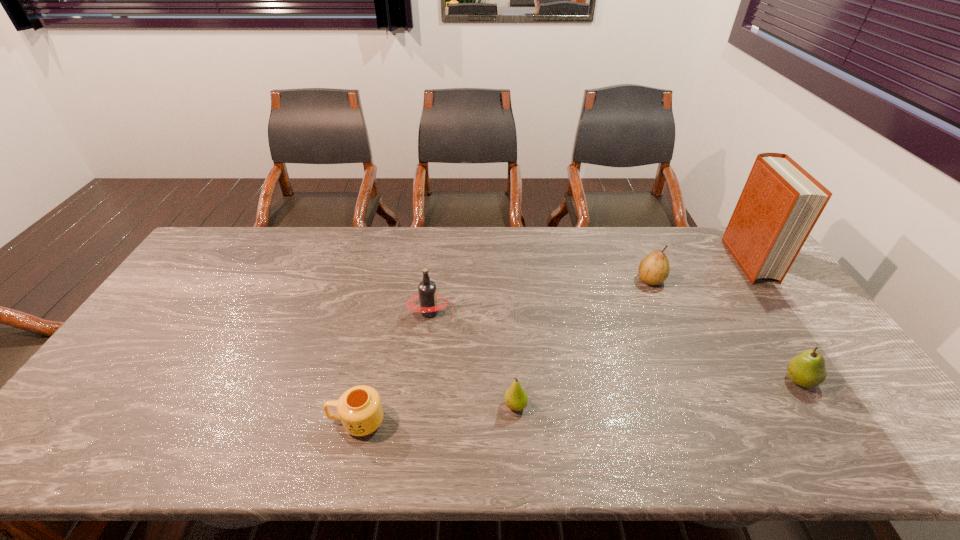
This screenshot has height=540, width=960. Find the location of `the rightmost object`. the rightmost object is located at coordinates (780, 203).

The image size is (960, 540). In order to click on hardback book in this screenshot , I will do `click(780, 203)`.

Locate an element on the screen. the second object from left to right is located at coordinates (427, 294).

Identify the location of the second tallest object. This screenshot has height=540, width=960. (427, 294).

The image size is (960, 540). Identify the location of the fourth object from left to right. (654, 269).

The height and width of the screenshot is (540, 960). I want to click on the farthest pear, so click(x=654, y=269).

I want to click on the fifth object from left to right, so click(807, 369).

Identify the location of the second nearest pear. This screenshot has height=540, width=960. (807, 369).

Where is `the fourth object from right to left`? The image size is (960, 540). the fourth object from right to left is located at coordinates (515, 397).

This screenshot has height=540, width=960. Find the location of `the nearest pear`. the nearest pear is located at coordinates (515, 397).